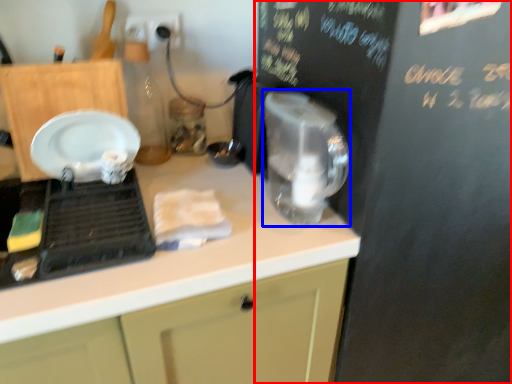
Question: Among these objects, which one is farthest to the camera, bulletin board (highlighted by a red box) or appliance (highlighted by a blue box)?

Choices:
 (A) bulletin board
 (B) appliance

Answer: (B)